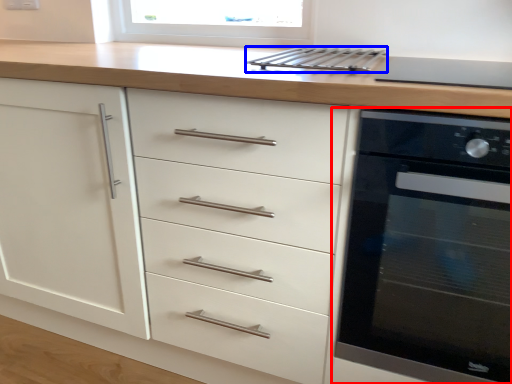
Question: Which of the following is the closest to the observer, home appliance (highlighted by a red box) or kitchen appliance (highlighted by a blue box)?

Choices:
 (A) home appliance
 (B) kitchen appliance

Answer: (A)